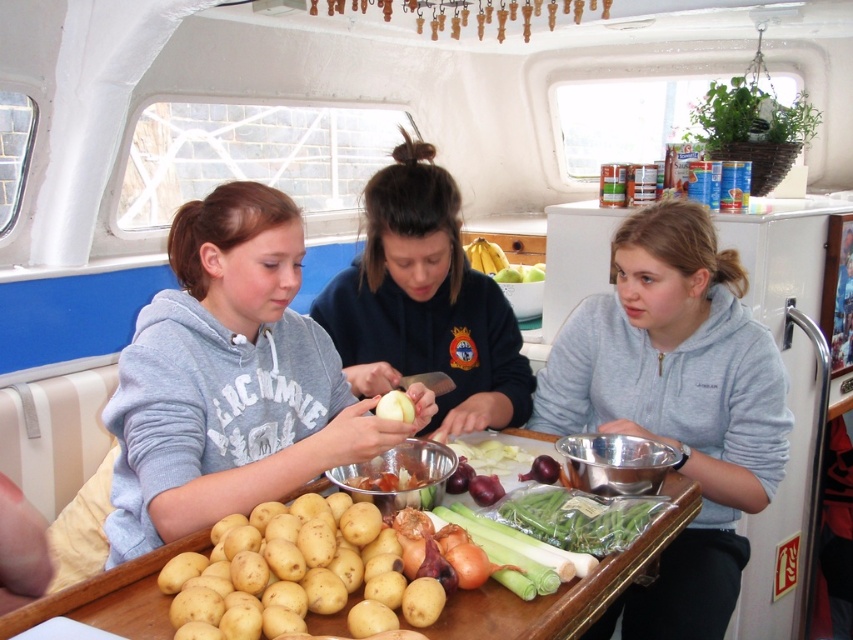
You are a chef standing behind the smooth wooden table at center and want to pick up the yellow matte potatoes at center. Can you reach them without moving your body?

The yellow matte potatoes at center are closer to the viewer than the smooth wooden table at center, so yes, you can reach them without moving your body since they are positioned nearer to you.

What is the exact coordinate of the gray fleece hoodie at center?

The gray fleece hoodie at center is located at coordinate point (676,404).

You are a chef preparing a meal and need to check the ingredients. You see the yellow matte potatoes at center and the smooth wooden table at center. Which object is on top of the other?

The yellow matte potatoes at center is positioned over smooth wooden table at center, so the yellow matte potatoes at center are on top of the smooth wooden table at center.